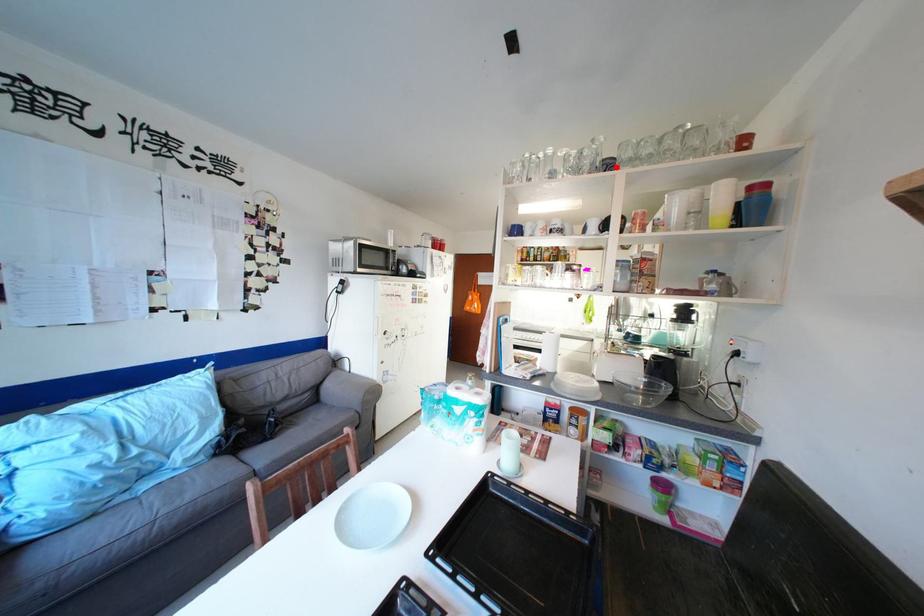
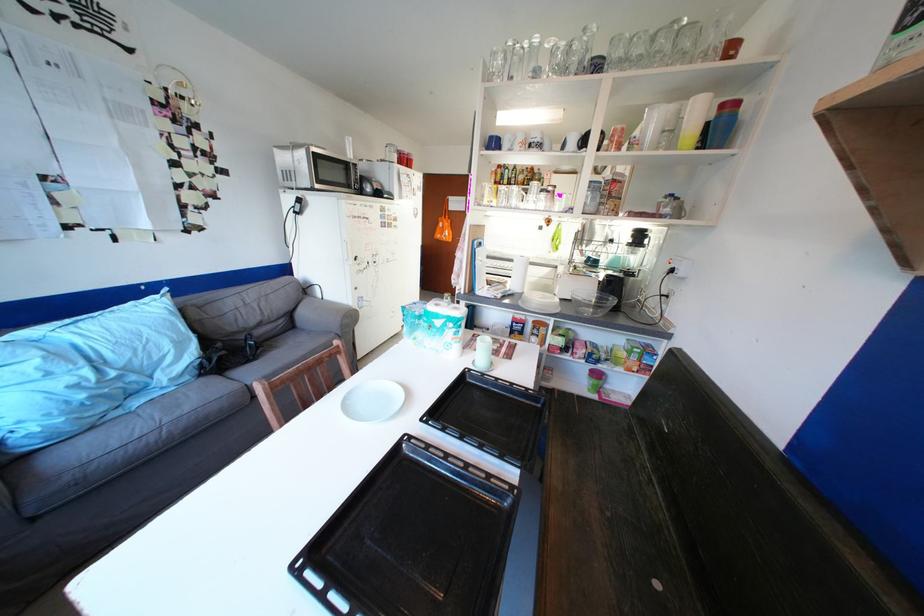
Find the pixel in the second image that matches the highlighted location in the first image.

(604, 68)